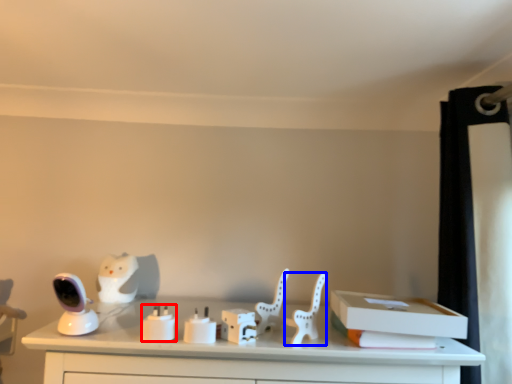
Question: Which point is closer to the camera, candle holder (highlighted by a red box) or chair (highlighted by a blue box)?

Choices:
 (A) candle holder
 (B) chair

Answer: (A)